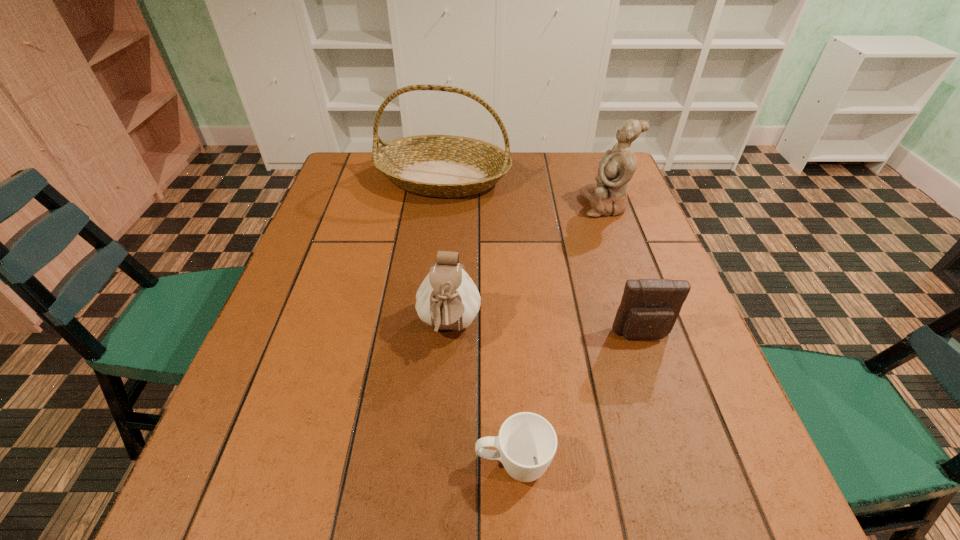
Identify which object is located as the nearest to the second shortest object. Please provide its 2D coordinates. Your answer should be formatted as a tuple, i.e. [(x, y)], where the tuple contains the x and y coordinates of a point satisfying the conditions above.

[(527, 442)]

The image size is (960, 540). I want to click on vacant region that satisfies the following two spatial constraints: 1. on the front-facing side of the figurine; 2. with an open flap on the second shortest object, so click(651, 335).

Locate an element on the screen. This screenshot has height=540, width=960. blank space that satisfies the following two spatial constraints: 1. on the front-facing side of the figurine; 2. with an open flap on the right pouch is located at coordinates point(651,335).

Locate an element on the screen. vacant space that satisfies the following two spatial constraints: 1. on the front-facing side of the figurine; 2. on the front-facing side of the left pouch is located at coordinates (649, 328).